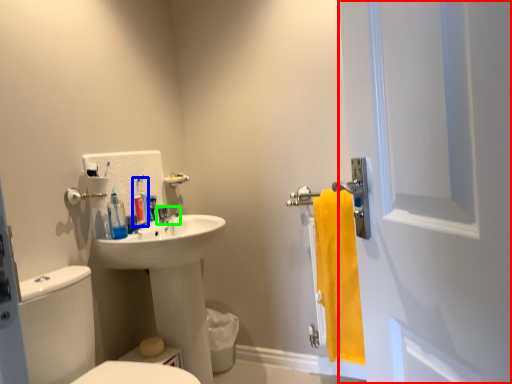
Question: Considering the real-world distances, which object is closest to screen door (highlighted by a red box)? toiletry (highlighted by a blue box) or tap (highlighted by a green box).

Choices:
 (A) toiletry
 (B) tap

Answer: (B)